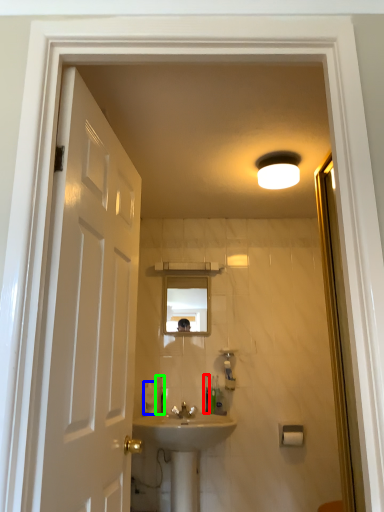
Question: Considering the real-world distances, which object is closest to toiletry (highlighted by a red box)? toiletry (highlighted by a blue box) or toiletry (highlighted by a green box).

Choices:
 (A) toiletry
 (B) toiletry

Answer: (B)